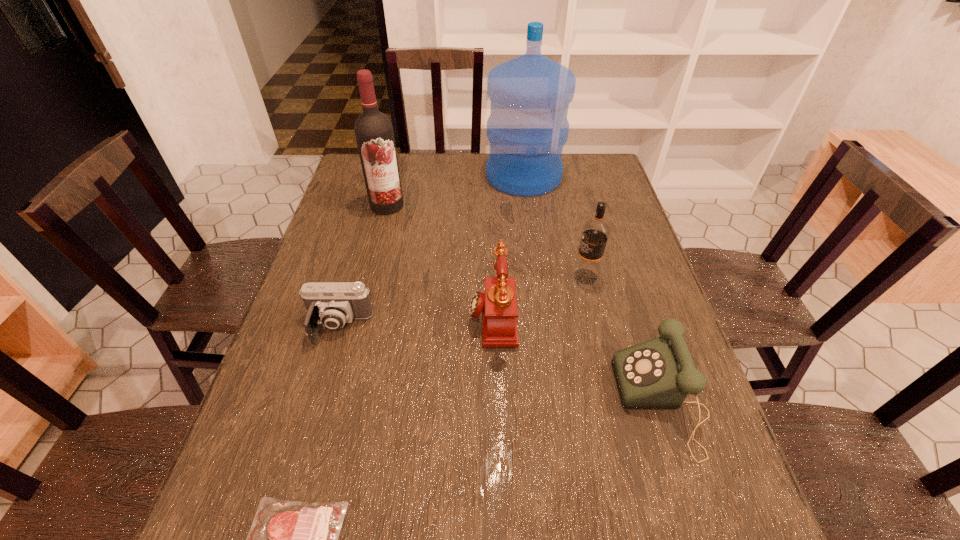
Where is `object that is at the far edge`? The width and height of the screenshot is (960, 540). object that is at the far edge is located at coordinates (527, 128).

I want to click on wine bottle that is at the left edge, so click(374, 134).

I want to click on camera at the left edge, so click(x=333, y=304).

Locate an element on the screen. vodka at the right edge is located at coordinates (595, 232).

Where is `telephone that is positioned at the right edge`? The image size is (960, 540). telephone that is positioned at the right edge is located at coordinates (657, 374).

This screenshot has height=540, width=960. In order to click on vacant space at the far edge of the desktop in this screenshot , I will do pyautogui.click(x=474, y=158).

This screenshot has height=540, width=960. What are the coordinates of `free space at the left edge` in the screenshot? It's located at (x=305, y=483).

Locate an element on the screen. This screenshot has width=960, height=540. free space at the right edge of the desktop is located at coordinates (622, 242).

Image resolution: width=960 pixels, height=540 pixels. In the image, there is a desktop. In order to click on free region at the far left corner in this screenshot , I will do `click(352, 157)`.

I want to click on vacant area at the far right corner of the desktop, so click(593, 164).